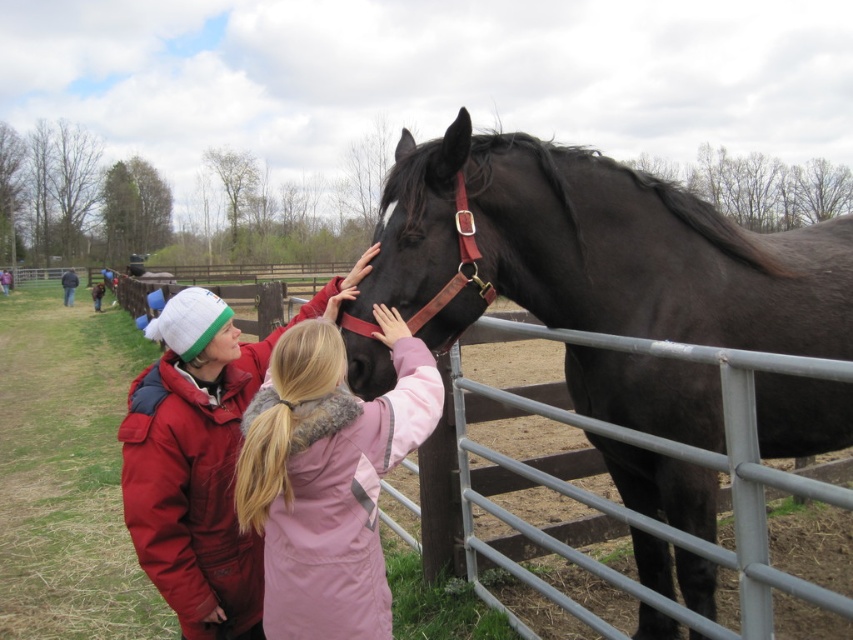
From the picture: You are a visitor at the farm and want to feed the black leather horse at center. The farm rule states that you must stay at least 2 meters away from the horse for safety. Are you within the safe distance?

The distance between you and the black leather horse at center is 2.43 meters, which is more than the required 2 meters, so you are within the safe distance.

You are standing at the point marked by the coordinates point (x=596, y=250). What object is directly in front of you?

The point (x=596, y=250) indicates black leather horse at center, so the object directly in front of you is the black leather horse at center.

You are a photographer trying to capture a closeup of the black leather horse at center and the pink fuzzy coat at center. Which object should you focus on first to ensure it appears sharp in your photo?

The black leather horse at center is closer to you than the pink fuzzy coat at center, so you should focus on the black leather horse at center first to ensure it appears sharp.